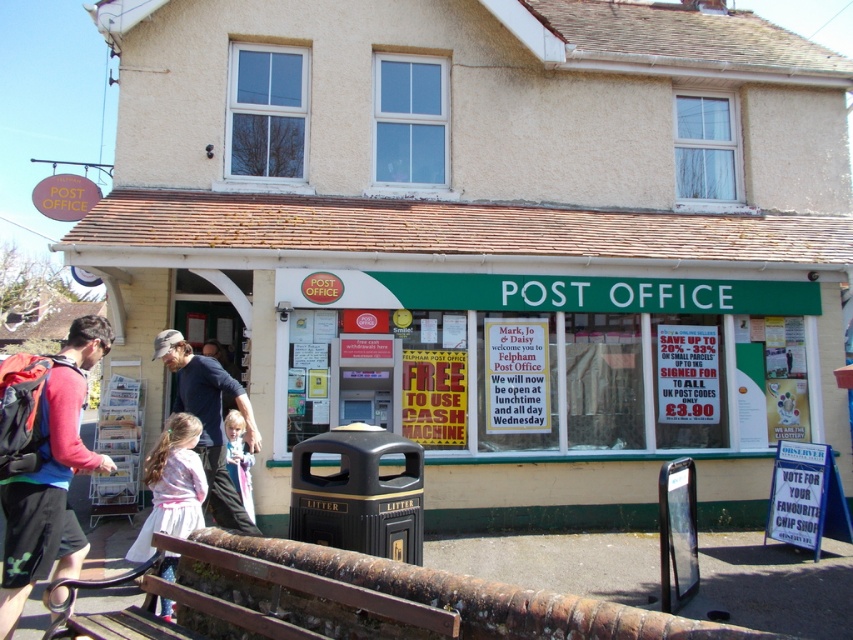
You are standing outside the post office and want to enter. There are two points marked on the ground. The first point is at coordinate point (833, 586), and the second point is at coordinate point (230, 429). Which point is closer to the entrance of the post office?

Point (833, 586) is in front of point (230, 429), so the entrance is closer to point (833, 586).

You are a customer waiting to enter the post office and see the rusty metal bench at lower left and the light pink fabric at lower left. Which object is closer to the entrance of the post office?

The rusty metal bench at lower left is closer to the entrance of the post office because it is below the light pink fabric at lower left, indicating it is positioned lower and nearer to the entrance.